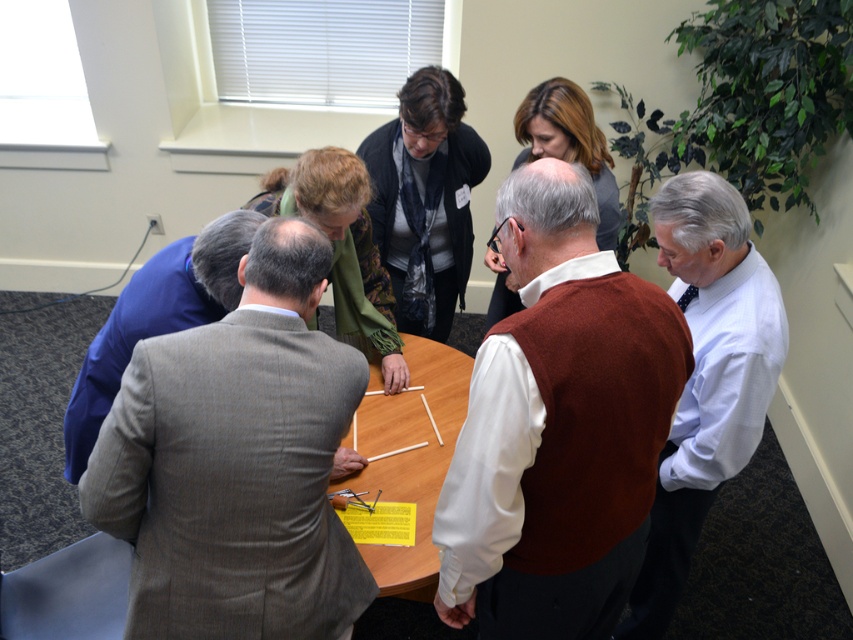
Question: Which point is closer to the camera?

Choices:
 (A) wooden at center
 (B) gray wool suit at center

Answer: (B)

Question: Is gray wool suit at center to the left of white shirt at center from the viewer's perspective?

Choices:
 (A) no
 (B) yes

Answer: (B)

Question: Which point is closer to the camera?

Choices:
 (A) wooden at center
 (B) white shirt at center
 (C) brown wool vest at center
 (D) gray wool suit at center

Answer: (C)

Question: Can you confirm if gray wool suit at center is positioned to the left of white shirt at center?

Choices:
 (A) yes
 (B) no

Answer: (A)

Question: From the image, what is the correct spatial relationship of brown wool vest at center in relation to white shirt at center?

Choices:
 (A) above
 (B) below

Answer: (A)

Question: Which object is farther from the camera taking this photo?

Choices:
 (A) wooden at center
 (B) gray wool suit at center
 (C) brown wool vest at center
 (D) white shirt at center

Answer: (A)